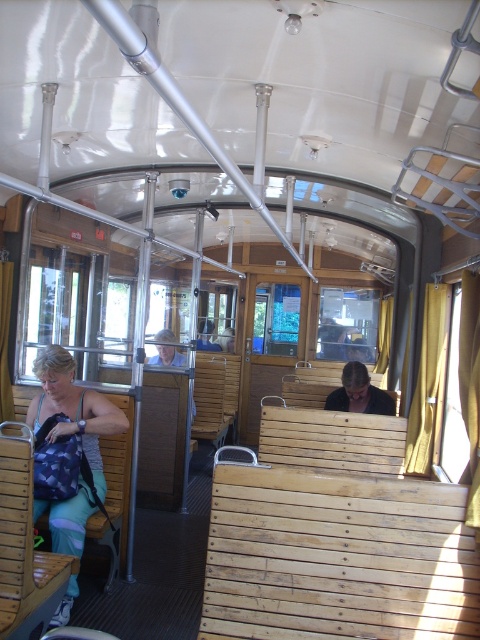
Question: Which point is closer to the camera taking this photo?

Choices:
 (A) (36, 451)
 (B) (370, 390)

Answer: (A)

Question: Can you confirm if matte blue backpack at left is positioned to the left of dark brown leather jacket at center?

Choices:
 (A) yes
 (B) no

Answer: (A)

Question: Among these objects, which one is nearest to the camera?

Choices:
 (A) matte blue backpack at left
 (B) dark brown leather jacket at center

Answer: (A)

Question: Where is matte blue backpack at left located in relation to dark brown leather jacket at center in the image?

Choices:
 (A) below
 (B) above

Answer: (A)

Question: Can you confirm if matte blue backpack at left is positioned to the right of dark brown leather jacket at center?

Choices:
 (A) no
 (B) yes

Answer: (A)